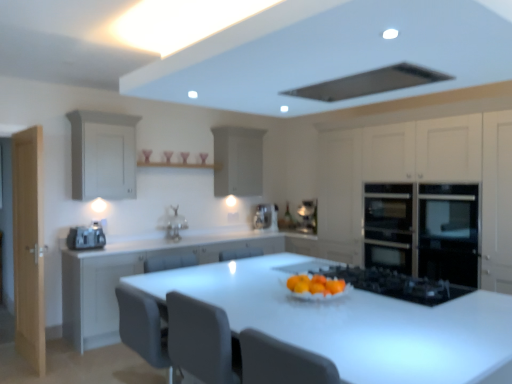
Question: Would you say white matte cabinet at center, which appears as the 2th cabinetry when viewed from the left, is inside or outside black stainless steel oven at right?

Choices:
 (A) outside
 (B) inside

Answer: (A)

Question: Considering the positions of white matte cabinet at center, which appears as the 2th cabinetry when viewed from the left, and black stainless steel oven at right in the image, is white matte cabinet at center, which appears as the 2th cabinetry when viewed from the left, bigger or smaller than black stainless steel oven at right?

Choices:
 (A) big
 (B) small

Answer: (A)

Question: Estimate the real-world distances between objects in this image. Which object is farther from the satin silver toaster at left?

Choices:
 (A) white matte cabinet at upper center, placed as the third cabinetry when sorted from left to right
 (B) black glass oven at right, which ranks as the 4th cabinetry in left-to-right order
 (C) light wood door at left
 (D) white matte cabinet at center, which appears as the 2th cabinetry when viewed from the left
 (E) matte white cabinet at left, arranged as the 4th cabinetry when viewed from the right

Answer: (B)

Question: Based on their relative distances, which object is nearer to the black stainless steel oven at right?

Choices:
 (A) white matte cabinet at center, which ranks as the third cabinetry in right-to-left order
 (B) matte silver sink at center
 (C) black matte exhaust hood at upper center
 (D) black glass oven at right, which ranks as the 4th cabinetry in left-to-right order
 (E) white glossy table at center

Answer: (D)